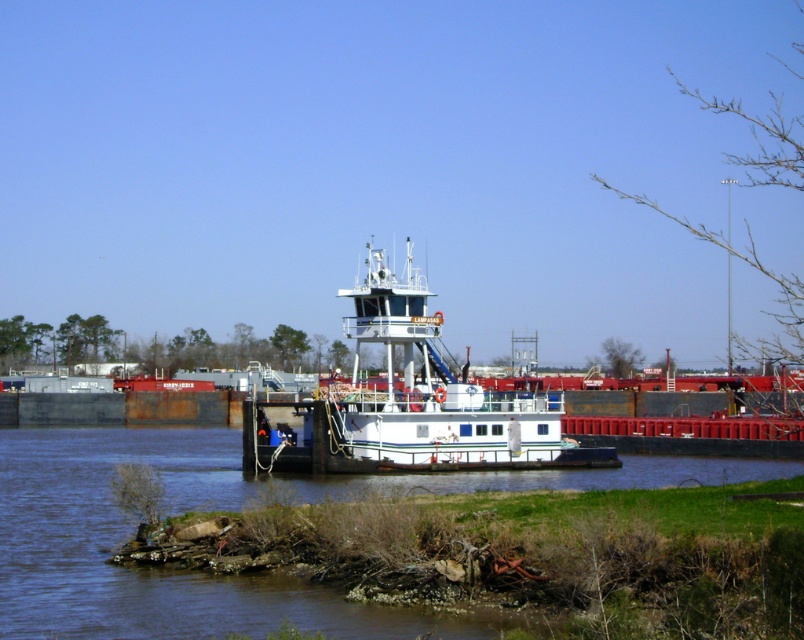
Which is above, blue painted steel river at center or white matte tugboat at center?

white matte tugboat at center

This screenshot has width=804, height=640. What are the coordinates of `blue painted steel river at center` in the screenshot? It's located at (129, 532).

You are a GUI agent. You are given a task and a screenshot of the screen. Output one action in this format:
    pyautogui.click(x=<x>, y=<y>)
    Task: Click on the blue painted steel river at center
    This screenshot has width=804, height=640.
    Given the screenshot: What is the action you would take?
    click(x=129, y=532)